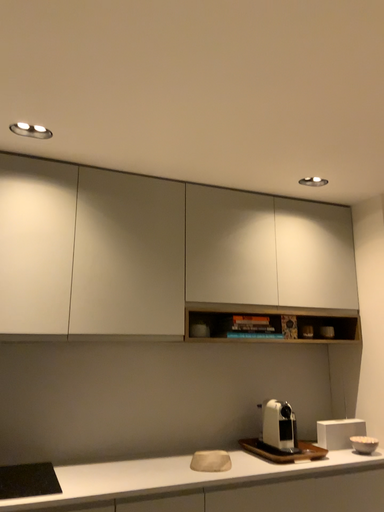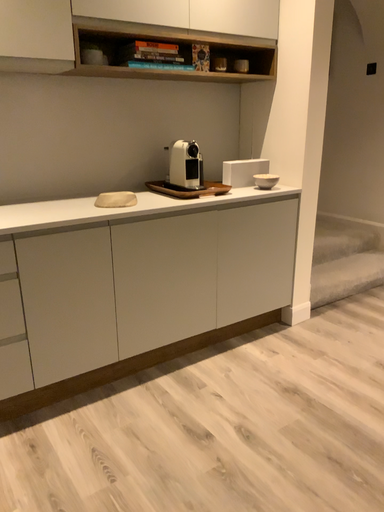
Question: How did the camera likely rotate when shooting the video?

Choices:
 (A) rotated upward
 (B) rotated downward

Answer: (B)